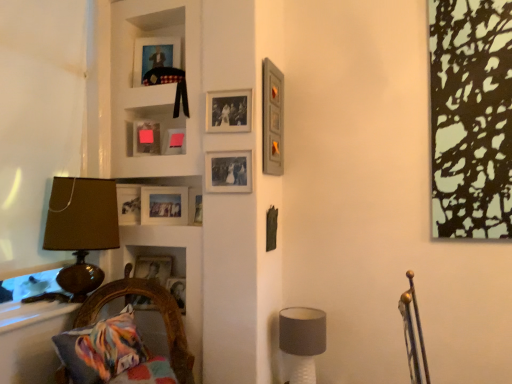
Describe the element at coordinates (155, 55) in the screenshot. I see `matte wooden picture frame at upper center, the eighth picture frame from the bottom` at that location.

The width and height of the screenshot is (512, 384). What do you see at coordinates (228, 171) in the screenshot? I see `matte silver picture frame at upper center, positioned as the sixth picture frame in top-to-bottom order` at bounding box center [228, 171].

The image size is (512, 384). Identify the location of brown fabric lampshade at left, placed as the second table lamp when sorted from right to left. (81, 229).

Find the location of a particular element. matte wooden picture frame at upper center, the eighth picture frame from the bottom is located at coordinates [x=155, y=55].

Is wooden picture frame at lower left, which is the first picture frame in bottom-to-top order, completely or partially outside of white matte cabinet at upper left?

Yes, wooden picture frame at lower left, which is the first picture frame in bottom-to-top order, is located beyond the bounds of white matte cabinet at upper left.

Can you confirm if wooden picture frame at lower left, the 8th picture frame from the top, is thinner than white matte cabinet at upper left?

Correct, the width of wooden picture frame at lower left, the 8th picture frame from the top, is less than that of white matte cabinet at upper left.

From the image's perspective, is wooden picture frame at lower left, the 8th picture frame from the top, above or below white matte cabinet at upper left?

wooden picture frame at lower left, the 8th picture frame from the top, is situated lower than white matte cabinet at upper left in the image.

Consider the image. Can you see matte gray lampshade at lower right, which appears as the second table lamp when viewed from the top, touching matte plastic picture frame at upper center, which is counted as the 5th picture frame, starting from the bottom?

No, matte gray lampshade at lower right, which appears as the second table lamp when viewed from the top, is not making contact with matte plastic picture frame at upper center, which is counted as the 5th picture frame, starting from the bottom.

Is matte gray lampshade at lower right, the second table lamp in the left-to-right sequence, shorter than matte plastic picture frame at upper center, which is the fourth picture frame in top-to-bottom order?

Incorrect, the height of matte gray lampshade at lower right, the second table lamp in the left-to-right sequence, does not fall short of that of matte plastic picture frame at upper center, which is the fourth picture frame in top-to-bottom order.

From the image's perspective, is matte gray lampshade at lower right, placed as the first table lamp when sorted from right to left, above or below matte plastic picture frame at upper center, which is counted as the 5th picture frame, starting from the bottom?

Clearly, from the image's perspective, matte gray lampshade at lower right, placed as the first table lamp when sorted from right to left, is below matte plastic picture frame at upper center, which is counted as the 5th picture frame, starting from the bottom.

Is matte gray lampshade at lower right, which appears as the second table lamp when viewed from the top, turned away from matte plastic picture frame at upper center, which is counted as the 5th picture frame, starting from the bottom?

That's not correct — matte gray lampshade at lower right, which appears as the second table lamp when viewed from the top, is not looking away from matte plastic picture frame at upper center, which is counted as the 5th picture frame, starting from the bottom.

Consider the image. Can brown fabric lampshade at left, placed as the second table lamp when sorted from right to left, be found inside multicolored fabric cushion at lower left?

No, brown fabric lampshade at left, placed as the second table lamp when sorted from right to left, is not surrounded by multicolored fabric cushion at lower left.

This screenshot has height=384, width=512. Find the location of `furniture lying in front of the brown fabric lampshade at left, the second table lamp when ordered from bottom to top`. furniture lying in front of the brown fabric lampshade at left, the second table lamp when ordered from bottom to top is located at coordinates (160, 312).

Is multicolored fabric cushion at lower left at the right side of brown fabric lampshade at left, which is counted as the first table lamp, starting from the top?

Yes, multicolored fabric cushion at lower left is to the right of brown fabric lampshade at left, which is counted as the first table lamp, starting from the top.

Which of these two, multicolored fabric cushion at lower left or brown fabric lampshade at left, placed as the second table lamp when sorted from right to left, stands taller?

brown fabric lampshade at left, placed as the second table lamp when sorted from right to left.

From a real-world perspective, relative to white glossy window sill at lower left, is wooden picture frame at lower left, the 8th picture frame from the top, vertically above or below?

wooden picture frame at lower left, the 8th picture frame from the top, is above white glossy window sill at lower left.

Considering the sizes of objects wooden picture frame at lower left, which is the first picture frame in bottom-to-top order, and white glossy window sill at lower left in the image provided, who is smaller, wooden picture frame at lower left, which is the first picture frame in bottom-to-top order, or white glossy window sill at lower left?

white glossy window sill at lower left is smaller.

From the image's perspective, is wooden picture frame at lower left, the 8th picture frame from the top, under white glossy window sill at lower left?

No.

Is point (178, 296) positioned behind point (25, 314)?

Yes, point (178, 296) is farther from viewer.

Is matte wooden picture frame at upper center, the 1th picture frame viewed from the top, to the right of matte silver picture frame at upper center, positioned as the sixth picture frame in top-to-bottom order, from the viewer's perspective?

No.

Is matte wooden picture frame at upper center, the eighth picture frame from the bottom, not within matte silver picture frame at upper center, positioned as the sixth picture frame in top-to-bottom order?

Yes, matte wooden picture frame at upper center, the eighth picture frame from the bottom, is not within matte silver picture frame at upper center, positioned as the sixth picture frame in top-to-bottom order.

From the image's perspective, between matte wooden picture frame at upper center, the 1th picture frame viewed from the top, and matte silver picture frame at upper center, which is counted as the 3th picture frame, starting from the bottom, who is located below?

matte silver picture frame at upper center, which is counted as the 3th picture frame, starting from the bottom, is shown below in the image.

Which of these two, matte wooden picture frame at upper center, the 1th picture frame viewed from the top, or matte silver picture frame at upper center, positioned as the sixth picture frame in top-to-bottom order, is smaller?

Smaller between the two is matte silver picture frame at upper center, positioned as the sixth picture frame in top-to-bottom order.

Looking at this image, which of these two, matte wooden picture frame at upper center, the eighth picture frame from the bottom, or matte gray lampshade at lower right, the second table lamp in the left-to-right sequence, stands taller?

Standing taller between the two is matte gray lampshade at lower right, the second table lamp in the left-to-right sequence.

In the scene shown: Is matte wooden picture frame at upper center, the eighth picture frame from the bottom, in front of or behind matte gray lampshade at lower right, the second table lamp in the left-to-right sequence, in the image?

matte wooden picture frame at upper center, the eighth picture frame from the bottom, is positioned farther from the viewer than matte gray lampshade at lower right, the second table lamp in the left-to-right sequence.

From the image's perspective, which object appears higher, matte wooden picture frame at upper center, the 1th picture frame viewed from the top, or matte gray lampshade at lower right, which appears as the second table lamp when viewed from the top?

matte wooden picture frame at upper center, the 1th picture frame viewed from the top.

This screenshot has width=512, height=384. I want to click on the 5th picture frame directly above the wooden picture frame at lower left, which is the first picture frame in bottom-to-top order (from a real-world perspective), so click(x=273, y=119).

Is wooden picture frame at lower left, which is the first picture frame in bottom-to-top order, inside or outside of matte gray picture frame at upper right, the sixth picture frame from the bottom?

wooden picture frame at lower left, which is the first picture frame in bottom-to-top order, is outside matte gray picture frame at upper right, the sixth picture frame from the bottom.

Based on the photo, would you consider wooden picture frame at lower left, the 8th picture frame from the top, to be distant from matte gray picture frame at upper right, the sixth picture frame from the bottom?

Yes, wooden picture frame at lower left, the 8th picture frame from the top, and matte gray picture frame at upper right, the sixth picture frame from the bottom, are located far from each other.

The width and height of the screenshot is (512, 384). What are the coordinates of `picture frame that is the 2nd one when counting rightward from the white matte cabinet at upper left` in the screenshot? It's located at (178, 291).

The height and width of the screenshot is (384, 512). Identify the location of table lamp that is the 2nd one below the matte plastic picture frame at upper center, which is the fourth picture frame in top-to-bottom order (from a real-world perspective). [301, 342].

From the image, which object appears to be nearer to matte gray picture frame at upper right, which is the 3th picture frame in top-to-bottom order, matte glass picture frame at center, marked as the second picture frame in a bottom-to-top arrangement, or pink matte picture frame at upper center, the fifth picture frame when ordered from top to bottom?

Based on the image, pink matte picture frame at upper center, the fifth picture frame when ordered from top to bottom, appears to be nearer to matte gray picture frame at upper right, which is the 3th picture frame in top-to-bottom order.

Based on their spatial positions, is white glossy window sill at lower left or matte silver picture frame at upper center, positioned as the sixth picture frame in top-to-bottom order, closer to matte glass picture frame at upper center, the second picture frame positioned from the top?

matte silver picture frame at upper center, positioned as the sixth picture frame in top-to-bottom order.

Which object lies nearer to the anchor point wooden picture frame at lower left, which is the first picture frame in bottom-to-top order, multicolored fabric cushion at lower left or matte gray picture frame at upper right, the sixth picture frame from the bottom?

The object closer to wooden picture frame at lower left, which is the first picture frame in bottom-to-top order, is multicolored fabric cushion at lower left.

Looking at the image, which one is located further to matte glass picture frame at center, marked as the second picture frame in a bottom-to-top arrangement, brown fabric lampshade at left, the second table lamp when ordered from bottom to top, or matte plastic picture frame at upper center, which is counted as the 5th picture frame, starting from the bottom?

Based on the image, brown fabric lampshade at left, the second table lamp when ordered from bottom to top, appears to be further to matte glass picture frame at center, marked as the second picture frame in a bottom-to-top arrangement.

Based on their spatial positions, is white matte cabinet at upper left or matte gray lampshade at lower right, which appears as the second table lamp when viewed from the top, closer to matte glass picture frame at center, placed as the seventh picture frame when sorted from top to bottom?

Based on the image, white matte cabinet at upper left appears to be nearer to matte glass picture frame at center, placed as the seventh picture frame when sorted from top to bottom.

When comparing their distances from white glossy window sill at lower left, does matte silver picture frame at upper center, which is counted as the 3th picture frame, starting from the bottom, or matte glass picture frame at center, marked as the second picture frame in a bottom-to-top arrangement, seem further?

matte silver picture frame at upper center, which is counted as the 3th picture frame, starting from the bottom, lies further to white glossy window sill at lower left than the other object.

Looking at the image, which one is located further to multicolored fabric cushion at lower left, pink matte picture frame at upper center, the 4th picture frame positioned from the bottom, or matte gray picture frame at upper right, the sixth picture frame from the bottom?

matte gray picture frame at upper right, the sixth picture frame from the bottom, lies further to multicolored fabric cushion at lower left than the other object.

Estimate the real-world distances between objects in this image. Which object is closer to matte gray picture frame at upper right, which is the 3th picture frame in top-to-bottom order, matte gray lampshade at lower right, which appears as the second table lamp when viewed from the top, or matte glass picture frame at upper center, the second picture frame positioned from the top?

Based on the image, matte glass picture frame at upper center, the second picture frame positioned from the top, appears to be nearer to matte gray picture frame at upper right, which is the 3th picture frame in top-to-bottom order.

Locate an element on the screen. The height and width of the screenshot is (384, 512). cabinet between matte wooden picture frame at upper center, the eighth picture frame from the bottom, and matte plastic picture frame at upper center, which is counted as the 5th picture frame, starting from the bottom, from top to bottom is located at coordinates (153, 86).

Find the location of a particular element. furniture between white matte cabinet at upper left and matte gray lampshade at lower right, placed as the first table lamp when sorted from right to left, in the up-down direction is located at coordinates (160, 312).

This screenshot has height=384, width=512. I want to click on cabinet between matte wooden picture frame at upper center, the 1th picture frame viewed from the top, and pink matte picture frame at upper center, the fifth picture frame when ordered from top to bottom, in the up-down direction, so click(x=153, y=86).

Image resolution: width=512 pixels, height=384 pixels. Identify the location of window sill between matte gray picture frame at upper right, the sixth picture frame from the bottom, and multicolored fabric cushion at lower left vertically. (31, 313).